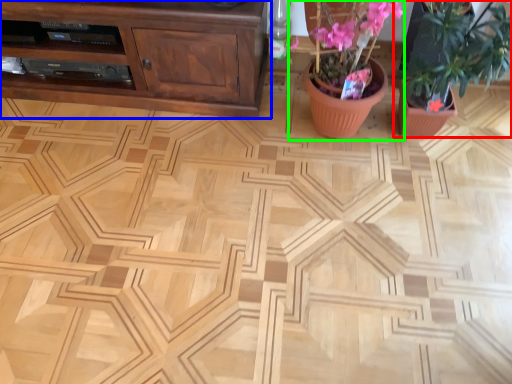
Question: Estimate the real-world distances between objects in this image. Which object is closer to houseplant (highlighted by a red box), cabinetry (highlighted by a blue box) or floral arrangement (highlighted by a green box)?

Choices:
 (A) cabinetry
 (B) floral arrangement

Answer: (B)